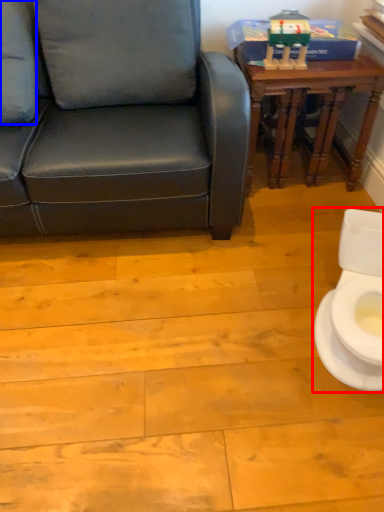
Question: Which object is further to the camera taking this photo, toilet (highlighted by a red box) or pillow (highlighted by a blue box)?

Choices:
 (A) toilet
 (B) pillow

Answer: (B)